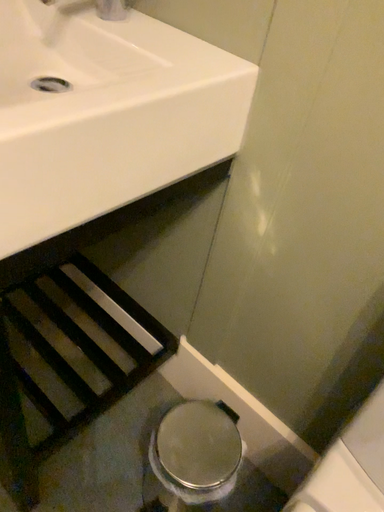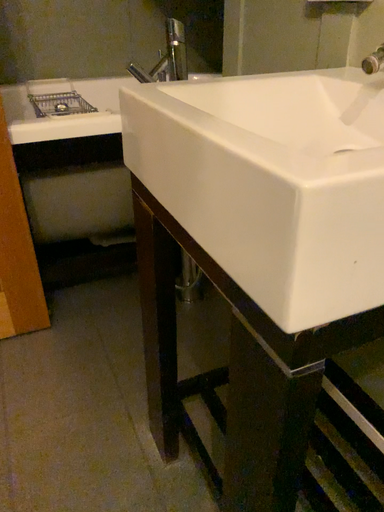
Question: How did the camera likely rotate when shooting the video?

Choices:
 (A) rotated right
 (B) rotated left

Answer: (B)